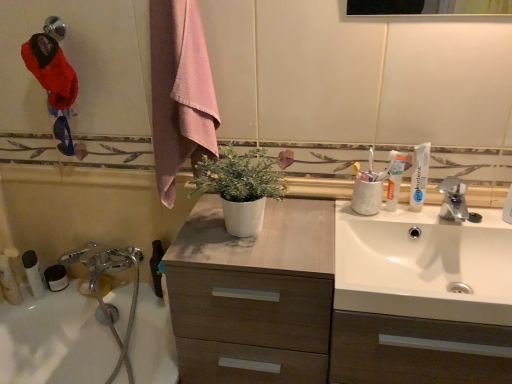
Find the location of a particular element. Image resolution: width=512 pixels, height=384 pixels. free area in between white matte toothpaste at upper right, the second toothpaste viewed from the right, and silver metallic faucet at upper right is located at coordinates (422, 218).